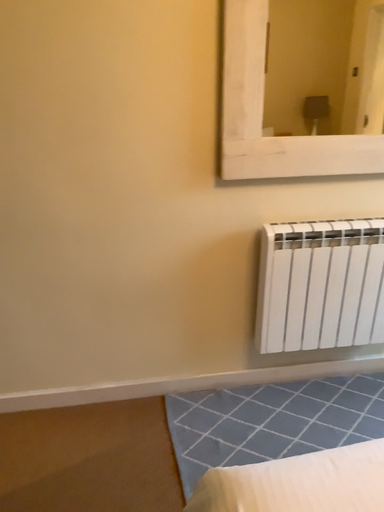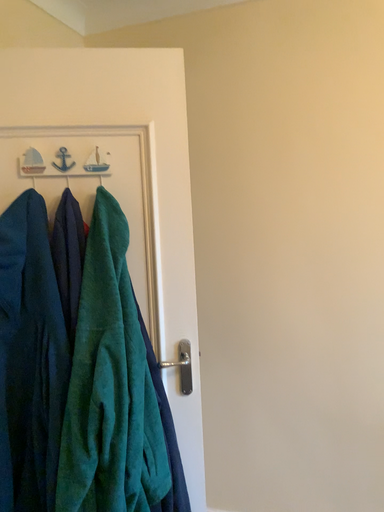
Question: How did the camera likely rotate when shooting the video?

Choices:
 (A) rotated right
 (B) rotated left

Answer: (B)